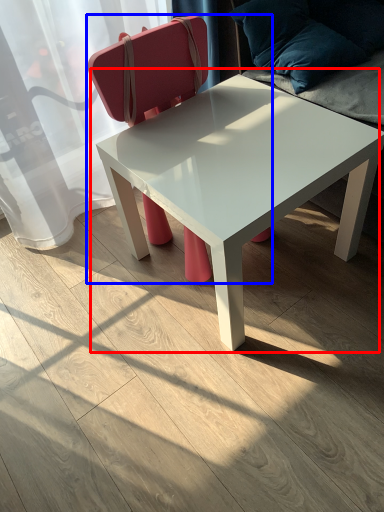
Question: Among these objects, which one is farthest to the camera, coffee table (highlighted by a red box) or chair (highlighted by a blue box)?

Choices:
 (A) coffee table
 (B) chair

Answer: (B)